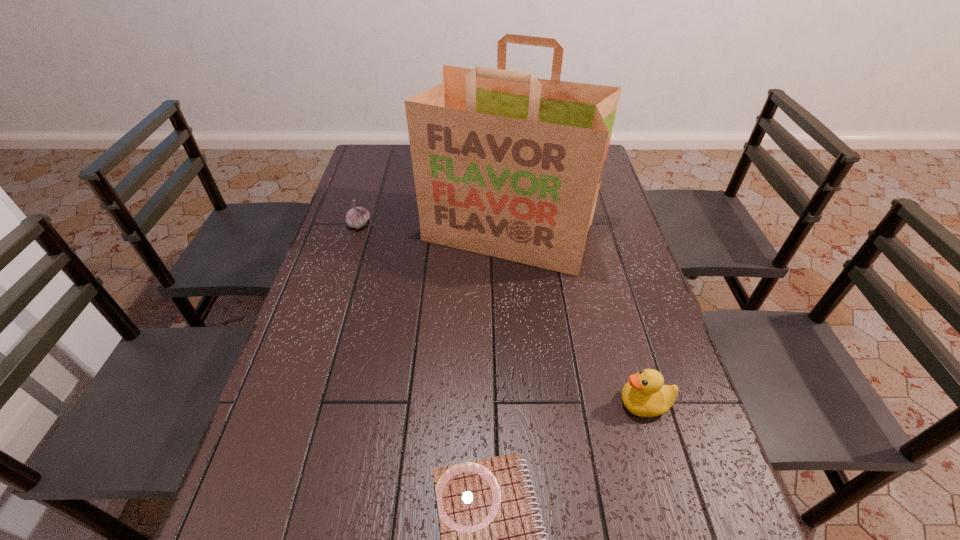
Choose which object is the second nearest neighbor to the leftmost object. Please provide its 2D coordinates. Your answer should be formatted as a tuple, i.e. [(x, y)], where the tuple contains the x and y coordinates of a point satisfying the conditions above.

[(491, 539)]

Identify which object is the third nearest to the shortest object. Please provide its 2D coordinates. Your answer should be formatted as a tuple, i.e. [(x, y)], where the tuple contains the x and y coordinates of a point satisfying the conditions above.

[(357, 217)]